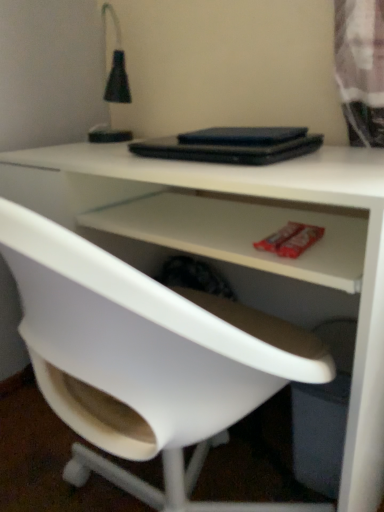
Image resolution: width=384 pixels, height=512 pixels. Describe the element at coordinates (232, 145) in the screenshot. I see `black matte laptop at center` at that location.

Locate an element on the screen. The width and height of the screenshot is (384, 512). black matte table lamp at upper left is located at coordinates (116, 65).

Measure the distance between point (185, 365) and camera.

Point (185, 365) is 18.86 inches from camera.

This screenshot has height=512, width=384. In order to click on white plastic chair at center in this screenshot , I will do point(145,360).

You are a GUI agent. You are given a task and a screenshot of the screen. Output one action in this format:
    pyautogui.click(x=<x>, y=<y>)
    Task: Click on the black matte laptop at center
    Image resolution: width=384 pixels, height=512 pixels.
    Given the screenshot: What is the action you would take?
    pyautogui.click(x=232, y=145)

Which object is closer to the camera taking this photo, black matte laptop at center or white plastic chair at center?

white plastic chair at center.

Are black matte laptop at center and white plastic chair at center beside each other?

No, black matte laptop at center is not in contact with white plastic chair at center.

Considering the positions of point (244, 154) and point (205, 389), is point (244, 154) closer or farther from the camera than point (205, 389)?

Point (244, 154).

Is black matte laptop at center at the left side of white plastic chair at center?

Incorrect, black matte laptop at center is not on the left side of white plastic chair at center.

Is black matte laptop at center facing towards black matte table lamp at upper left?

No, black matte laptop at center is not facing towards black matte table lamp at upper left.

Would you say black matte laptop at center is a long distance from black matte table lamp at upper left?

Actually, black matte laptop at center and black matte table lamp at upper left are a little close together.

From a real-world perspective, who is located lower, black matte laptop at center or black matte table lamp at upper left?

From a 3D spatial view, black matte laptop at center is below.

Would you consider black matte table lamp at upper left to be distant from white plastic chair at center?

Actually, black matte table lamp at upper left and white plastic chair at center are a little close together.

Considering the relative sizes of black matte table lamp at upper left and white plastic chair at center in the image provided, is black matte table lamp at upper left bigger than white plastic chair at center?

No, black matte table lamp at upper left is not bigger than white plastic chair at center.

Which object is further away from the camera, black matte table lamp at upper left or white plastic chair at center?

Positioned behind is black matte table lamp at upper left.

Which object is positioned more to the left, black matte table lamp at upper left or white plastic chair at center?

From the viewer's perspective, black matte table lamp at upper left appears more on the left side.

In the scene shown: Does white plastic chair at center touch black matte table lamp at upper left?

white plastic chair at center and black matte table lamp at upper left are not in contact.

Is white plastic chair at center in front of or behind black matte table lamp at upper left in the image?

white plastic chair at center is positioned closer to the viewer than black matte table lamp at upper left.

From a real-world perspective, between white plastic chair at center and black matte table lamp at upper left, who is vertically higher?

From a 3D spatial view, black matte table lamp at upper left is above.

How different are the orientations of white plastic chair at center and black matte laptop at center in degrees?

0.15 degrees separate the facing orientations of white plastic chair at center and black matte laptop at center.

Considering the sizes of objects white plastic chair at center and black matte laptop at center in the image provided, who is thinner, white plastic chair at center or black matte laptop at center?

black matte laptop at center.

From a real-world perspective, is white plastic chair at center above or below black matte laptop at center?

white plastic chair at center is below black matte laptop at center.

Would you say white plastic chair at center is outside black matte laptop at center?

Yes, white plastic chair at center is located beyond the bounds of black matte laptop at center.

What's the angular difference between black matte table lamp at upper left and black matte laptop at center's facing directions?

There is a 40.9-degree angle between the facing directions of black matte table lamp at upper left and black matte laptop at center.

Based on the photo, visually, is black matte table lamp at upper left positioned to the left or to the right of black matte laptop at center?

Clearly, black matte table lamp at upper left is on the left of black matte laptop at center in the image.

From their relative heights in the image, would you say black matte table lamp at upper left is taller or shorter than black matte laptop at center?

Considering their sizes, black matte table lamp at upper left has more height than black matte laptop at center.

Which is correct: black matte table lamp at upper left is inside black matte laptop at center, or outside of it?

black matte table lamp at upper left is located beyond the bounds of black matte laptop at center.

Identify the location of chair that is under the black matte laptop at center (from a real-world perspective). The image size is (384, 512). (145, 360).

You are a GUI agent. You are given a task and a screenshot of the screen. Output one action in this format:
    pyautogui.click(x=<x>, y=<y>)
    Task: Click on the laptop below the black matte table lamp at upper left (from the image's perspective)
    Image resolution: width=384 pixels, height=512 pixels.
    Given the screenshot: What is the action you would take?
    pyautogui.click(x=232, y=145)

Based on their spatial positions, is white plastic chair at center or black matte laptop at center closer to black matte table lamp at upper left?

The object closer to black matte table lamp at upper left is black matte laptop at center.

Which object lies nearer to the anchor point black matte table lamp at upper left, black matte laptop at center or white plastic chair at center?

black matte laptop at center is positioned closer to the anchor black matte table lamp at upper left.

Based on their spatial positions, is black matte table lamp at upper left or white plastic chair at center closer to black matte laptop at center?

black matte table lamp at upper left.

Considering their positions, is black matte laptop at center positioned closer to white plastic chair at center than black matte table lamp at upper left?

black matte laptop at center.

Considering their positions, is white plastic chair at center positioned further to black matte laptop at center than black matte table lamp at upper left?

The object further to black matte laptop at center is white plastic chair at center.

When comparing their distances from white plastic chair at center, does black matte table lamp at upper left or black matte laptop at center seem further?

black matte table lamp at upper left.

Locate an element on the screen. The height and width of the screenshot is (512, 384). laptop between black matte table lamp at upper left and white plastic chair at center in the vertical direction is located at coordinates (232, 145).